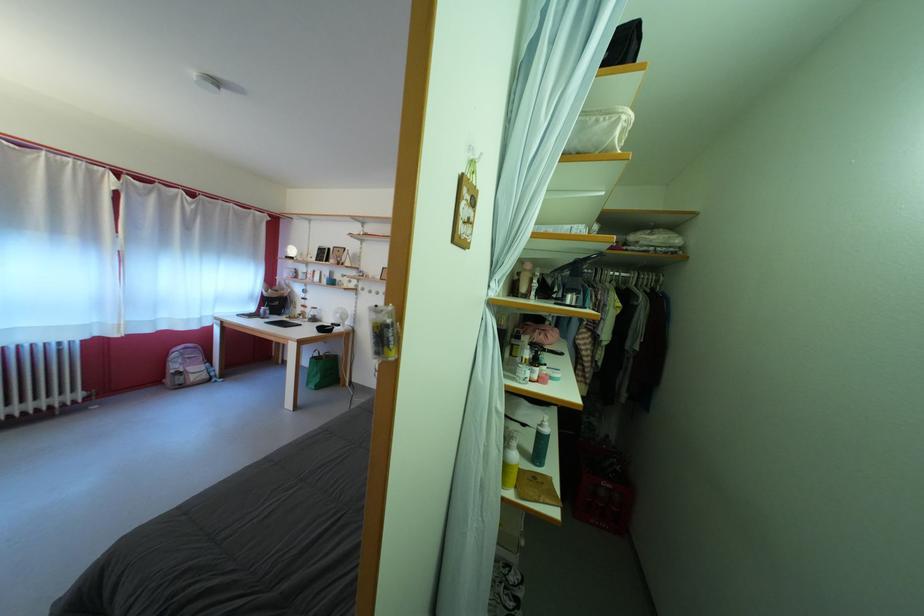
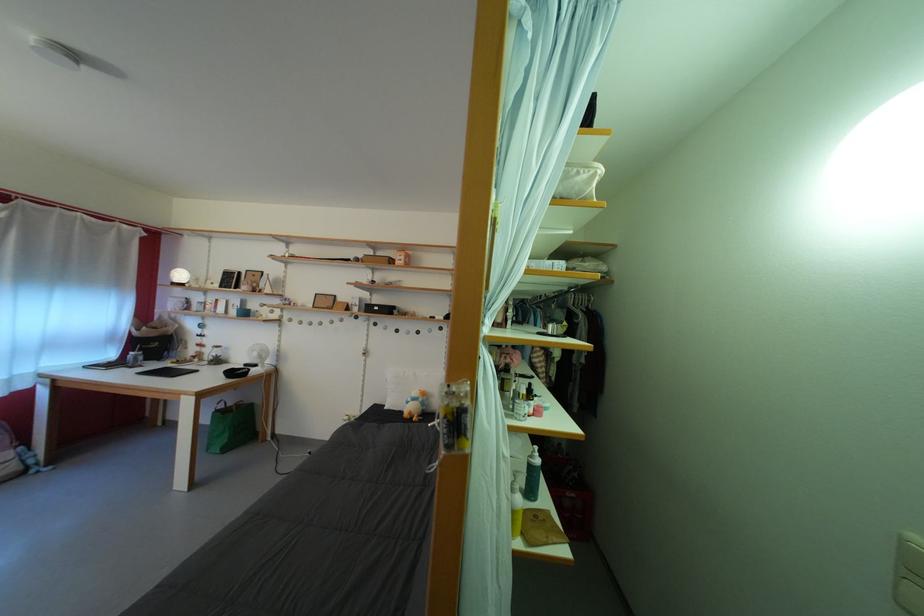
In the second image, find the point that corresponds to (x=346, y=283) in the first image.

(261, 312)